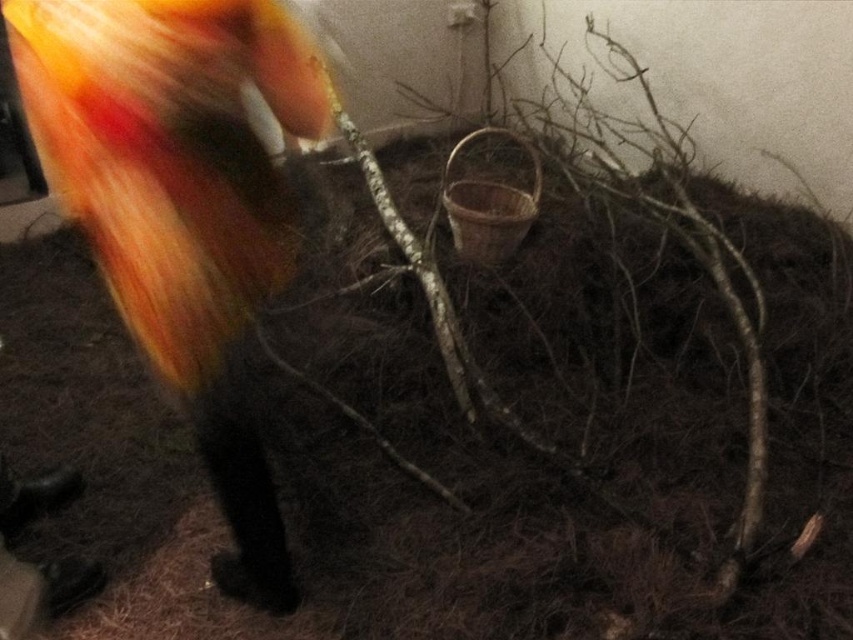
Question: Is fluffy orange-yellow tail at upper left to the right of brown textured stick at center from the viewer's perspective?

Choices:
 (A) yes
 (B) no

Answer: (B)

Question: Where is fluffy orange-yellow tail at upper left located in relation to brown textured stick at center in the image?

Choices:
 (A) below
 (B) above

Answer: (A)

Question: Which of the following is the farthest from the observer?

Choices:
 (A) (666, 218)
 (B) (96, 122)

Answer: (A)

Question: Which object appears closest to the camera in this image?

Choices:
 (A) brown textured stick at center
 (B) fluffy orange-yellow tail at upper left

Answer: (B)

Question: Is fluffy orange-yellow tail at upper left thinner than brown textured stick at center?

Choices:
 (A) no
 (B) yes

Answer: (A)